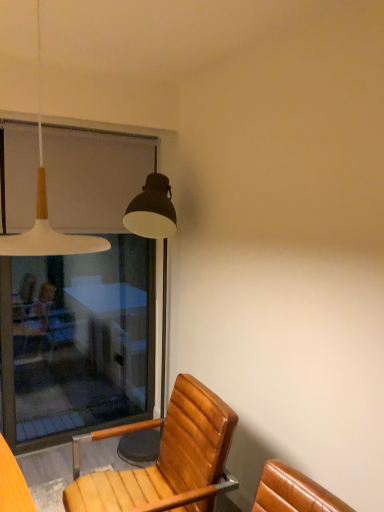
Question: Is white matte pendant light at upper left at the back of transparent glass screen door at left?

Choices:
 (A) yes
 (B) no

Answer: (B)

Question: Considering the relative positions of transparent glass screen door at left and white matte pendant light at upper left in the image provided, is transparent glass screen door at left to the left of white matte pendant light at upper left from the viewer's perspective?

Choices:
 (A) yes
 (B) no

Answer: (A)

Question: Are transparent glass screen door at left and white matte pendant light at upper left making contact?

Choices:
 (A) yes
 (B) no

Answer: (B)

Question: Is transparent glass screen door at left positioned beyond the bounds of white matte pendant light at upper left?

Choices:
 (A) yes
 (B) no

Answer: (A)

Question: Can you confirm if transparent glass screen door at left is thinner than white matte pendant light at upper left?

Choices:
 (A) yes
 (B) no

Answer: (A)

Question: From a real-world perspective, relative to white matte pendant light at upper left, is wooden chair at lower center vertically above or below?

Choices:
 (A) above
 (B) below

Answer: (B)

Question: Is wooden chair at lower center in front of or behind white matte pendant light at upper left in the image?

Choices:
 (A) front
 (B) behind

Answer: (B)

Question: In terms of width, does wooden chair at lower center look wider or thinner when compared to white matte pendant light at upper left?

Choices:
 (A) thin
 (B) wide

Answer: (B)

Question: From their relative heights in the image, would you say wooden chair at lower center is taller or shorter than white matte pendant light at upper left?

Choices:
 (A) tall
 (B) short

Answer: (A)

Question: From a real-world perspective, is wooden chair at lower center physically located above or below transparent glass screen door at left?

Choices:
 (A) below
 (B) above

Answer: (A)

Question: In the image, is wooden chair at lower center positioned in front of or behind transparent glass screen door at left?

Choices:
 (A) front
 (B) behind

Answer: (A)

Question: Would you say wooden chair at lower center is inside or outside transparent glass screen door at left?

Choices:
 (A) outside
 (B) inside

Answer: (A)

Question: Considering the positions of point (170, 430) and point (39, 268), is point (170, 430) closer or farther from the camera than point (39, 268)?

Choices:
 (A) closer
 (B) farther

Answer: (A)

Question: Which is correct: transparent glass screen door at left is inside wooden chair at lower center, or outside of it?

Choices:
 (A) inside
 (B) outside

Answer: (B)

Question: Looking at their shapes, would you say transparent glass screen door at left is wider or thinner than wooden chair at lower center?

Choices:
 (A) thin
 (B) wide

Answer: (A)